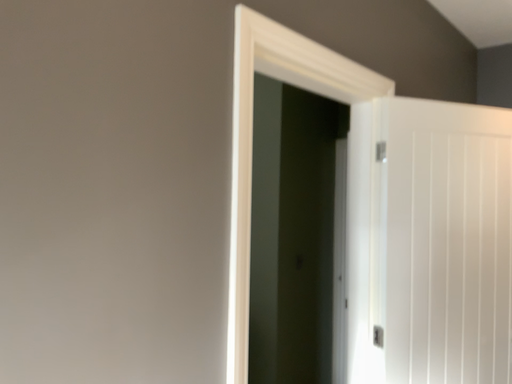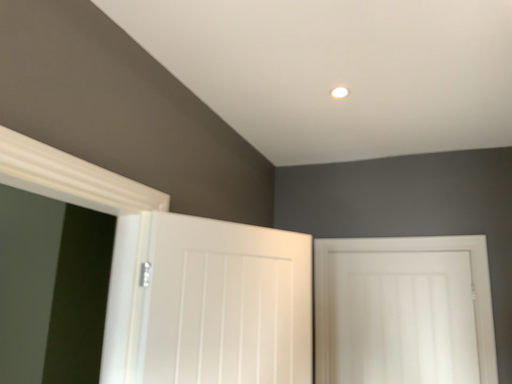
Question: How did the camera likely rotate when shooting the video?

Choices:
 (A) rotated right
 (B) rotated left

Answer: (A)